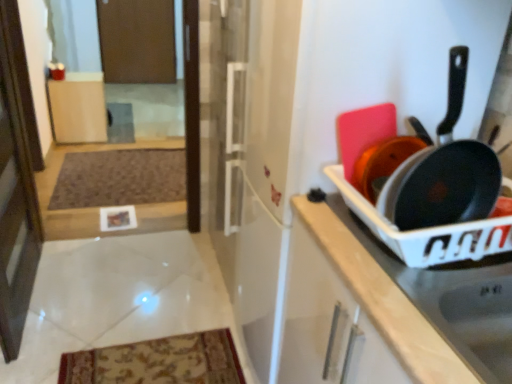
Question: Does brown textured mat at lower left have a greater width compared to matte wood cabinet at center, the first cabinetry viewed from the back?

Choices:
 (A) yes
 (B) no

Answer: (A)

Question: Can you confirm if brown textured mat at lower left is bigger than matte wood cabinet at center, marked as the second cabinetry in a bottom-to-top arrangement?

Choices:
 (A) yes
 (B) no

Answer: (B)

Question: Does brown textured mat at lower left turn towards matte wood cabinet at center, marked as the second cabinetry in a bottom-to-top arrangement?

Choices:
 (A) no
 (B) yes

Answer: (A)

Question: Considering the relative positions of brown textured mat at lower left and matte wood cabinet at center, marked as the second cabinetry in a bottom-to-top arrangement, in the image provided, is brown textured mat at lower left to the right of matte wood cabinet at center, marked as the second cabinetry in a bottom-to-top arrangement, from the viewer's perspective?

Choices:
 (A) yes
 (B) no

Answer: (A)

Question: From the image's perspective, does brown textured mat at lower left appear lower than matte wood cabinet at center, which is the first cabinetry from left to right?

Choices:
 (A) yes
 (B) no

Answer: (A)

Question: Is matte wood cabinet at center, which is the first cabinetry from left to right, inside the boundaries of matte black pan at right, or outside?

Choices:
 (A) inside
 (B) outside

Answer: (B)

Question: From a real-world perspective, relative to matte black pan at right, is matte wood cabinet at center, the first cabinetry viewed from the back, vertically above or below?

Choices:
 (A) below
 (B) above

Answer: (A)

Question: In the image, is matte wood cabinet at center, which is the second cabinetry from right to left, positioned in front of or behind matte black pan at right?

Choices:
 (A) front
 (B) behind

Answer: (B)

Question: Considering the relative positions of matte wood cabinet at center, which is the 2th cabinetry from front to back, and matte black pan at right in the image provided, is matte wood cabinet at center, which is the 2th cabinetry from front to back, to the left or to the right of matte black pan at right?

Choices:
 (A) left
 (B) right

Answer: (A)

Question: From a real-world perspective, is matte black pan at right above or below transparent glass screen door at left, which ranks as the first screen door in bottom-to-top order?

Choices:
 (A) above
 (B) below

Answer: (A)

Question: Is matte black pan at right taller or shorter than transparent glass screen door at left, which ranks as the first screen door in bottom-to-top order?

Choices:
 (A) tall
 (B) short

Answer: (B)

Question: Considering the positions of matte black pan at right and transparent glass screen door at left, the 1th screen door viewed from the front, in the image, is matte black pan at right wider or thinner than transparent glass screen door at left, the 1th screen door viewed from the front,?

Choices:
 (A) wide
 (B) thin

Answer: (A)

Question: Is matte black pan at right inside the boundaries of transparent glass screen door at left, the 1th screen door viewed from the front, or outside?

Choices:
 (A) outside
 (B) inside

Answer: (A)

Question: Considering the relative positions of transparent glass screen door at left, positioned as the 2th screen door in top-to-bottom order, and brown textured mat at lower left in the image provided, is transparent glass screen door at left, positioned as the 2th screen door in top-to-bottom order, to the left or to the right of brown textured mat at lower left?

Choices:
 (A) right
 (B) left

Answer: (B)

Question: Is transparent glass screen door at left, the 1th screen door viewed from the front, bigger or smaller than brown textured mat at lower left?

Choices:
 (A) small
 (B) big

Answer: (B)